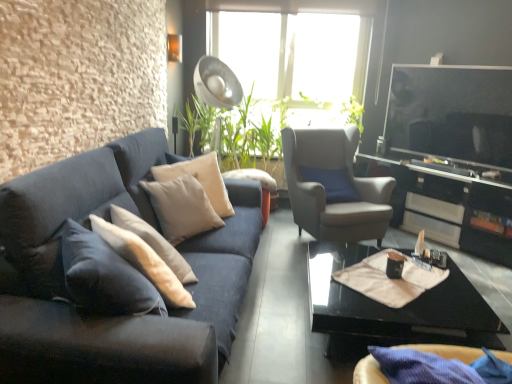
Question: Looking at the image, does black glossy entertainment center at right seem bigger or smaller compared to velvet dark blue couch at left?

Choices:
 (A) big
 (B) small

Answer: (A)

Question: In terms of height, does black glossy entertainment center at right look taller or shorter compared to velvet dark blue couch at left?

Choices:
 (A) short
 (B) tall

Answer: (A)

Question: Estimate the real-world distances between objects in this image. Which object is farther from the velvet dark blue couch at left?

Choices:
 (A) suede-like gray armchair at center-right
 (B) creamy white fabric pillow at center, the second pillow when ordered from front to back
 (C) black glossy entertainment center at right
 (D) black glossy coffee table at lower right
 (E) beige fabric at center

Answer: (C)

Question: Which object is positioned farthest from the black glossy entertainment center at right?

Choices:
 (A) creamy white fabric pillow at center, the second pillow when ordered from front to back
 (B) beige fabric at center
 (C) beige fabric pillow at center, arranged as the 2th pillow when viewed from the back
 (D) velvet dark blue couch at left
 (E) suede-like gray armchair at center-right

Answer: (D)